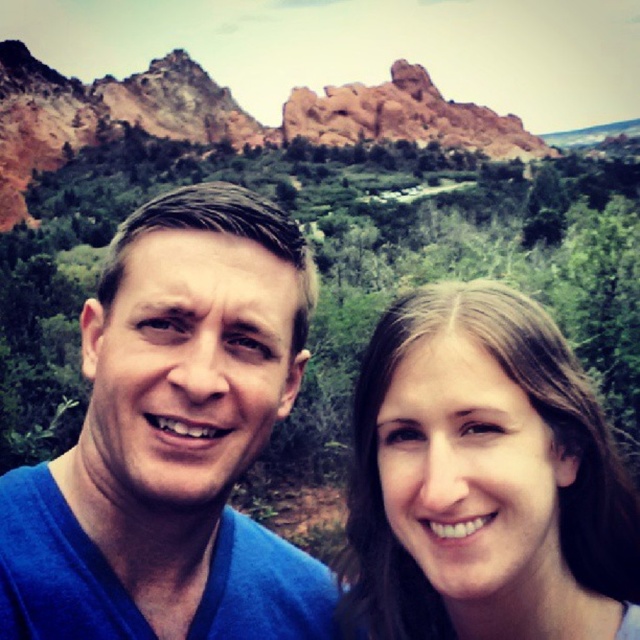
Question: Is blue fabric at center positioned at the back of smooth brown hair at center?

Choices:
 (A) yes
 (B) no

Answer: (B)

Question: Where is blue fabric at center located in relation to smooth brown hair at center in the image?

Choices:
 (A) below
 (B) above

Answer: (B)

Question: Which point is farther from the camera taking this photo?

Choices:
 (A) (124, 225)
 (B) (534, 609)

Answer: (A)

Question: Can you confirm if blue fabric at center is positioned below smooth brown hair at center?

Choices:
 (A) yes
 (B) no

Answer: (B)